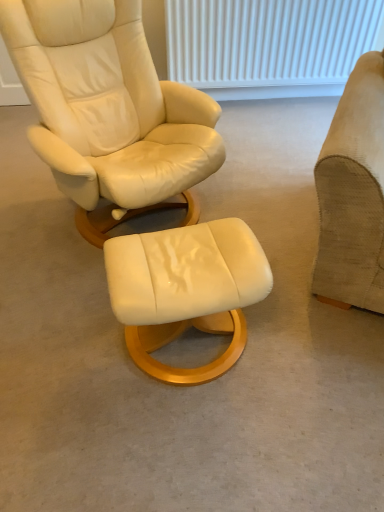
Locate an element on the screen. unoccupied area behind suede beige armchair at right is located at coordinates (274, 166).